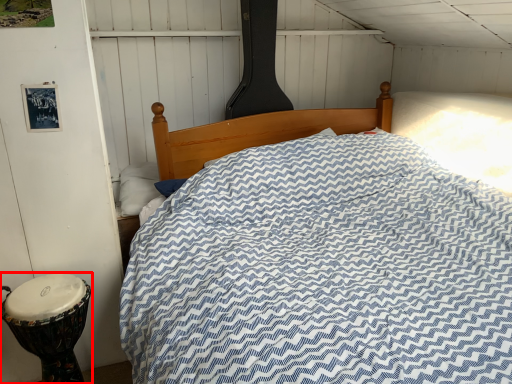
Question: In this image, where is drum (annotated by the red box) located relative to pillow?

Choices:
 (A) left
 (B) right

Answer: (A)